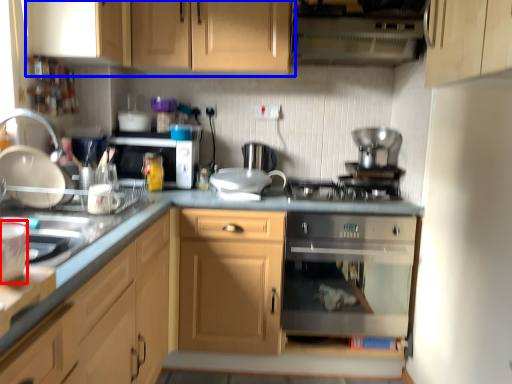
Question: Which object appears closest to the camera in this image, appliance (highlighted by a red box) or cabinetry (highlighted by a blue box)?

Choices:
 (A) appliance
 (B) cabinetry

Answer: (A)